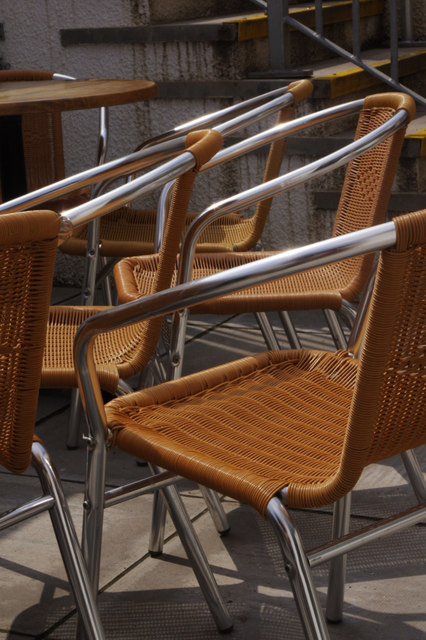
Locate an element on the screen. The height and width of the screenshot is (640, 426). mould is located at coordinates (226, 57), (409, 176).